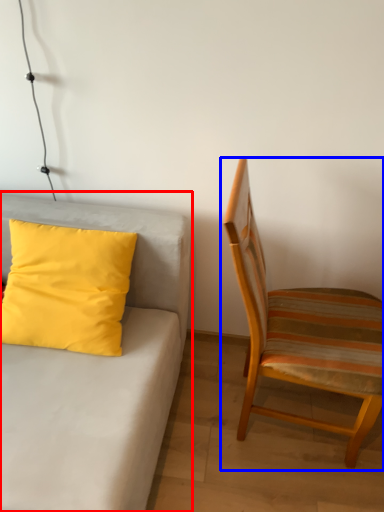
Question: Which point is further to the camera, studio couch (highlighted by a red box) or chair (highlighted by a blue box)?

Choices:
 (A) studio couch
 (B) chair

Answer: (B)